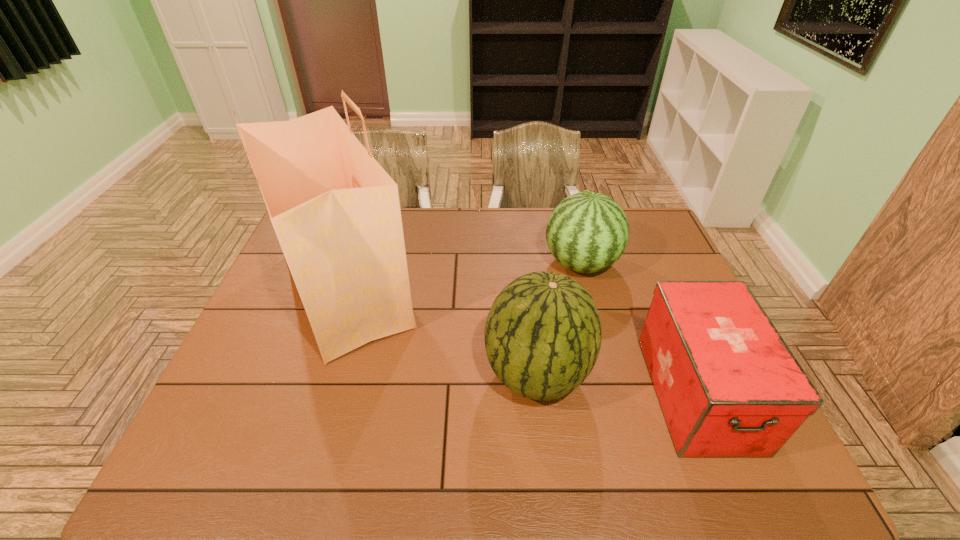
Locate an element on the screen. This screenshot has height=540, width=960. object at the near edge is located at coordinates (728, 385).

Identify the location of object that is at the left edge. (336, 212).

I want to click on object situated at the right edge, so click(x=728, y=385).

This screenshot has height=540, width=960. I want to click on object situated at the far left corner, so click(336, 212).

Identify the location of object located at the near right corner. The height and width of the screenshot is (540, 960). (728, 385).

Identify the location of free location at the near edge of the desktop. The image size is (960, 540). (552, 449).

Where is `vacant point at the left edge`? The height and width of the screenshot is (540, 960). vacant point at the left edge is located at coordinates (268, 305).

You are a GUI agent. You are given a task and a screenshot of the screen. Output one action in this format:
    pyautogui.click(x=<x>, y=<y>)
    Task: Click on the blank space at the far right corner of the desktop
    This screenshot has height=540, width=960.
    Given the screenshot: What is the action you would take?
    pyautogui.click(x=660, y=239)

You are a GUI agent. You are given a task and a screenshot of the screen. Output one action in this format:
    pyautogui.click(x=<x>, y=<y>)
    Task: Click on the free space between the first-aid kit and the farther watermelon
    The height and width of the screenshot is (540, 960).
    Given the screenshot: What is the action you would take?
    pyautogui.click(x=639, y=328)

I want to click on empty space that is in between the tallest object and the nearer watermelon, so click(441, 333).